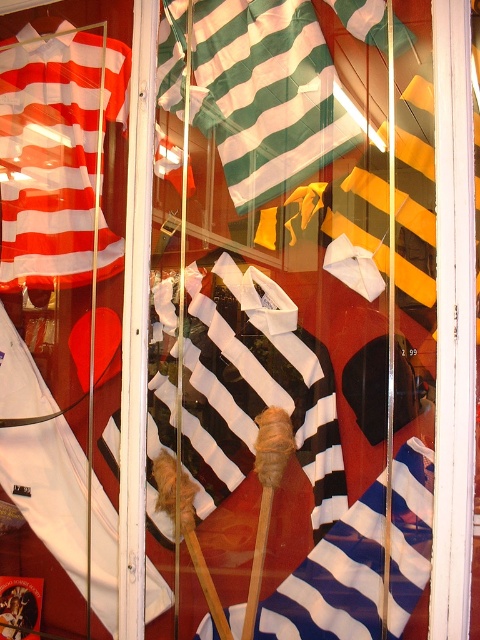
You are a customer looking at the display window. You see the green striped fabric at center and the blue striped fabric at center. Which one takes up more space in the window?

The green striped fabric at center is bigger than the blue striped fabric at center, so it takes up more space in the window.

You are standing in front of the store window and notice two points marked on the display. The first point is at coordinate point (219, 88) and the second is at coordinate point (72, 244). Which point do you think is closer to you?

Point (219, 88) is closer to the viewer than point (72, 244).